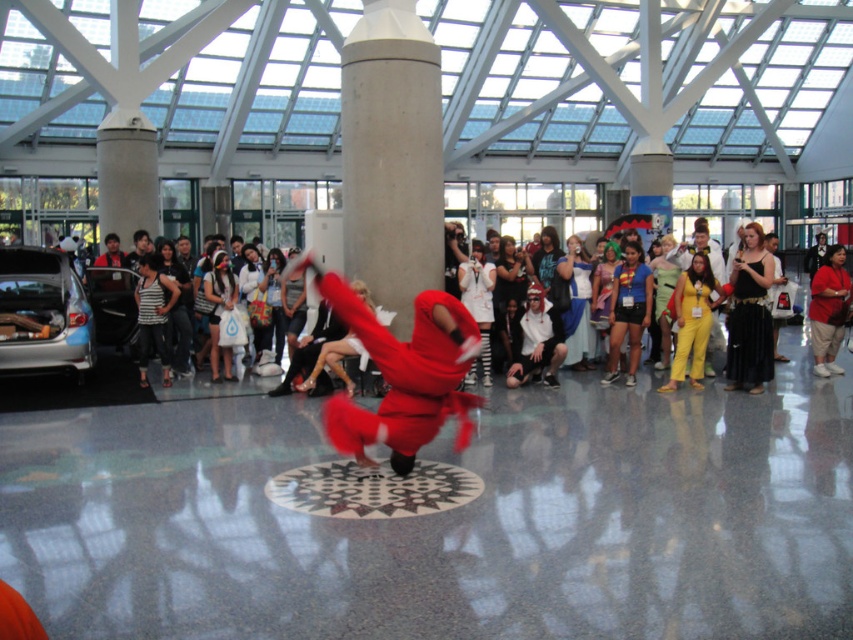
You are a photographer standing at the back of the room and want to capture a clear photo of the matte red costume at center without the concrete pillar at center blocking it. Is this possible given their sizes?

The concrete pillar at center is much taller than the matte red costume at center, so it might block the view. To capture a clear photo, you could try moving to a lower angle or position where the pillar doesn

You are standing at the entrance of the building and want to find the concrete pillar at center. According to the coordinates provided, where should you look relative to your position?

The concrete pillar at center is located at coordinates point (392, 156), which means it is positioned 24.5 percent from the left and 46 percent from the top of the image frame.